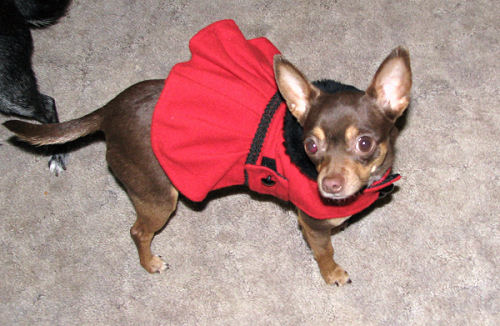
Where is `carpet`? Image resolution: width=500 pixels, height=326 pixels. carpet is located at coordinates 408,237.